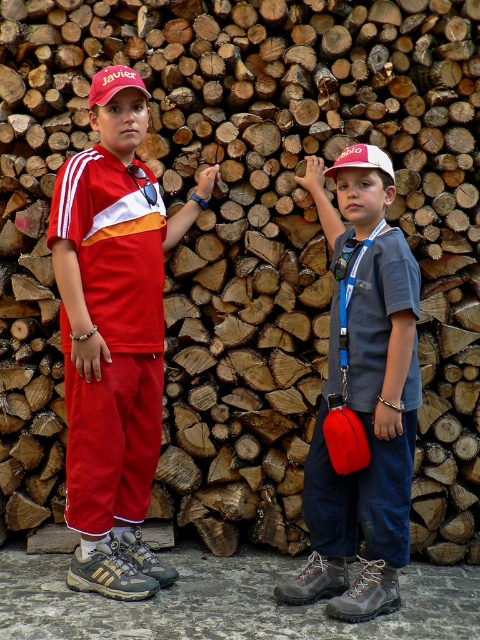
You are a photographer trying to capture a closeup of the matte gray shirt at center. Given that the camera focuses on the point at coordinates point (362, 401), will the matte gray shirt at center be in focus?

The matte gray shirt at center is represented by point (362, 401), so yes, the camera focusing on that point will have the matte gray shirt at center in focus.

You are a photographer standing 2 meters away from the matte red baseball cap at upper left and the white fabric baseball cap at upper center. You want to take a photo that captures both caps in the frame. Can you fit both caps into the photo without moving your position?

The distance between the matte red baseball cap at upper left and the white fabric baseball cap at upper center is 1.31 meters. Since you are 2 meters away from both caps, the camera should be able to capture both in the frame as the distance between them is less than the maximum field of view at that distance.